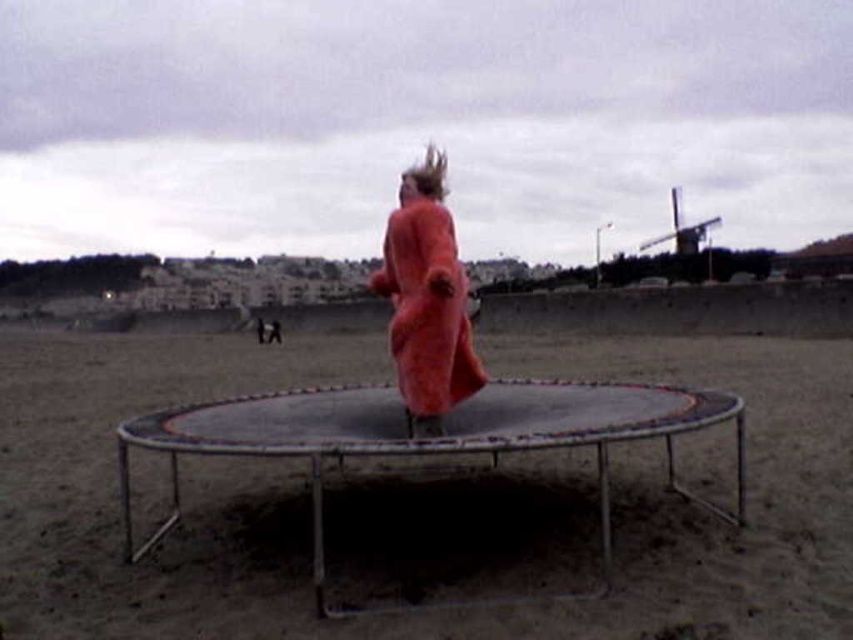
Question: Is brown sandy dirt at center smaller than fuzzy coral coat at center?

Choices:
 (A) no
 (B) yes

Answer: (B)

Question: In this image, where is brown sandy dirt at center located relative to fuzzy coral coat at center?

Choices:
 (A) left
 (B) right

Answer: (A)

Question: Can you confirm if brown sandy dirt at center is bigger than fuzzy coral coat at center?

Choices:
 (A) yes
 (B) no

Answer: (B)

Question: Which of the following is the farthest from the observer?

Choices:
 (A) fuzzy coral coat at center
 (B) brown sandy dirt at center

Answer: (A)